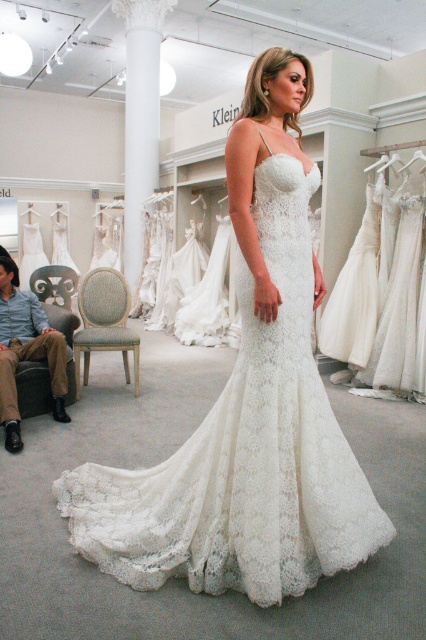
Who is lower down, white lace dress at center or white marble column at center?

white lace dress at center is lower down.

Does white lace dress at center have a larger size compared to white marble column at center?

Actually, white lace dress at center might be smaller than white marble column at center.

Who is more forward, (239, 545) or (132, 17)?

Positioned in front is point (239, 545).

Find the location of a particular element. white lace dress at center is located at coordinates (247, 406).

Does white lace dress at center appear on the left side of matte white dress at lower left?

No, white lace dress at center is not to the left of matte white dress at lower left.

Which is in front, point (235, 134) or point (34, 355)?

Point (235, 134) is more forward.

This screenshot has width=426, height=640. Find the location of `white lace dress at center`. white lace dress at center is located at coordinates (247, 406).

Can you confirm if white marble column at center is positioned to the right of matte white dress at lower left?

Yes, white marble column at center is to the right of matte white dress at lower left.

Which is behind, point (127, 236) or point (5, 266)?

The point (127, 236) is more distant.

Which is behind, point (138, 4) or point (20, 316)?

The point (138, 4) is more distant.

Identify the location of white marble column at center. Image resolution: width=426 pixels, height=640 pixels. (140, 120).